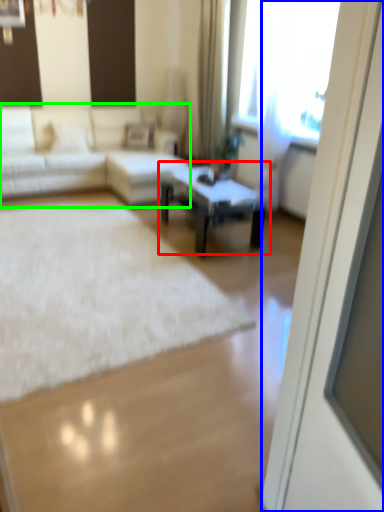
Question: Which object is the closest to the coffee table (highlighted by a red box)? Choose among these: screen door (highlighted by a blue box) or studio couch (highlighted by a green box).

Choices:
 (A) screen door
 (B) studio couch

Answer: (B)